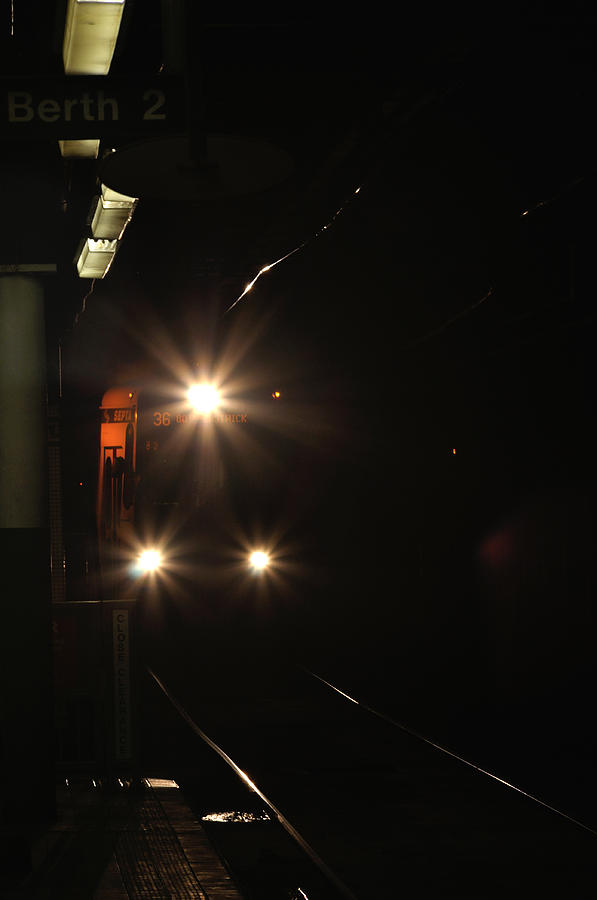
At what (x,y) coordinates should I click in order to perform the action: click on right light. Please return your answer as a coordinate pair (x, y). This screenshot has width=597, height=900. Looking at the image, I should click on (261, 562).